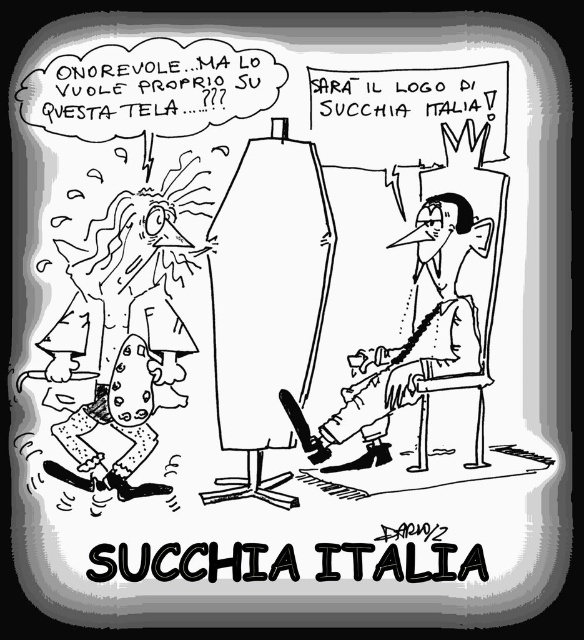
This screenshot has width=584, height=640. What are the coordinates of `smooth skin man at center` in the screenshot? It's located at (408, 337).

Is point (401, 346) positioned before point (127, 371)?

No, it is not.

At what (x,y) coordinates should I click in order to perform the action: click on smooth skin man at center. Please return your answer as a coordinate pair (x, y). The height and width of the screenshot is (640, 584). Looking at the image, I should click on (408, 337).